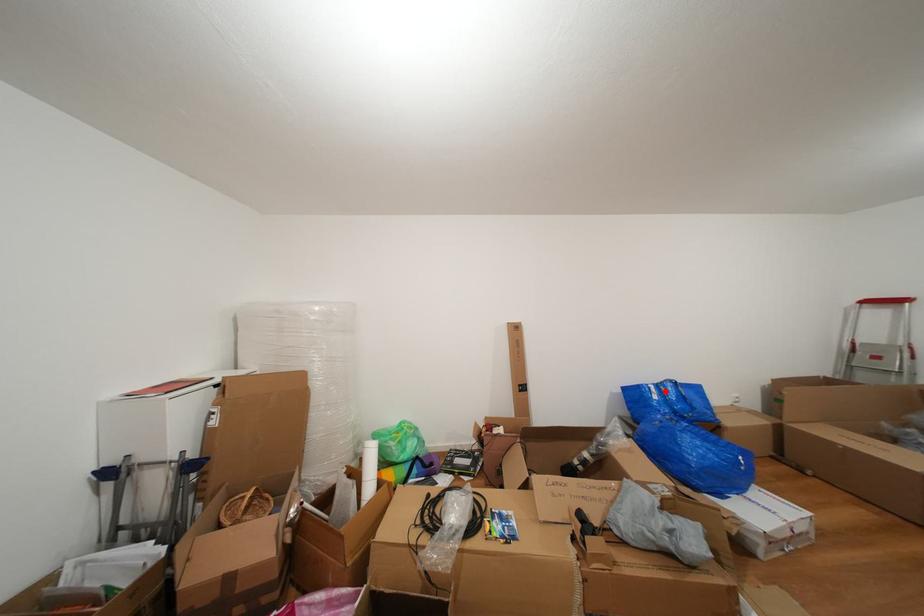
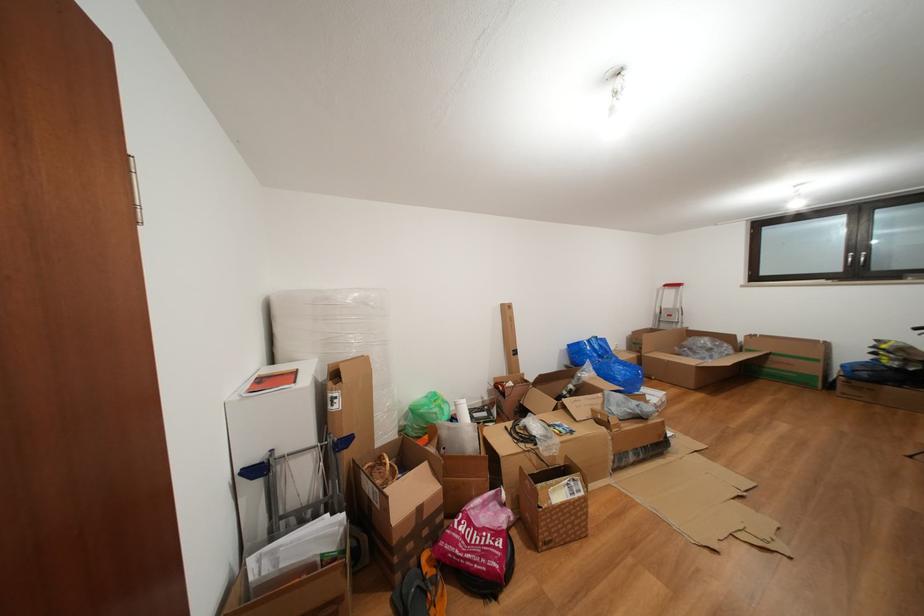
Question: A red point is marked in image1. In image2, is the corresponding 3D point closer to the camera or farther? Reply with the corresponding letter.

Choices:
 (A) The corresponding 3D point is closer.
 (B) The corresponding 3D point is farther.

Answer: (A)